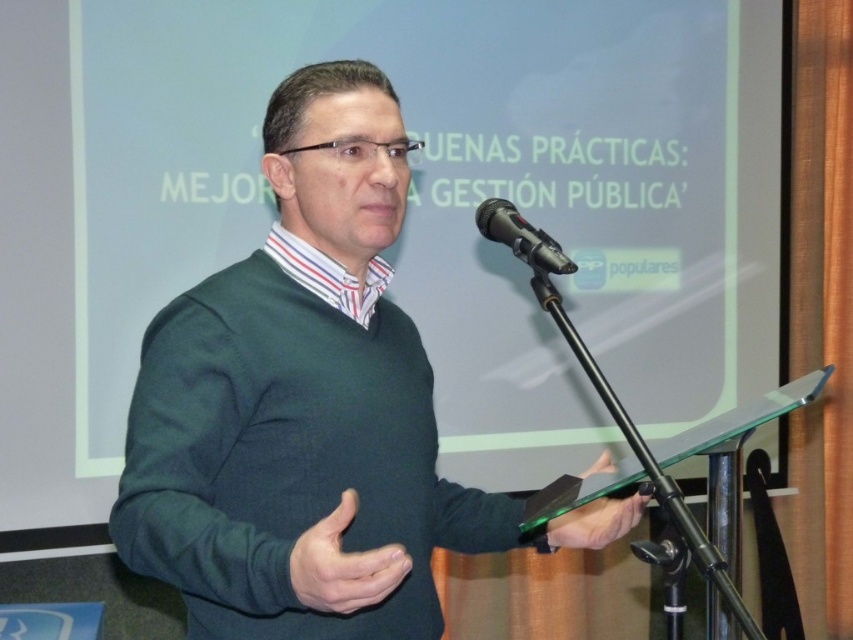
Question: Is green matte sweater at center closer to the viewer compared to black metallic microphone at center?

Choices:
 (A) no
 (B) yes

Answer: (B)

Question: Can you confirm if green matte sweater at center is smaller than black metallic microphone at center?

Choices:
 (A) yes
 (B) no

Answer: (B)

Question: Which object is farther from the camera taking this photo?

Choices:
 (A) green matte sweater at center
 (B) black metallic microphone at center

Answer: (B)

Question: Is green matte sweater at center above black metallic microphone at center?

Choices:
 (A) yes
 (B) no

Answer: (B)

Question: Among these points, which one is nearest to the camera?

Choices:
 (A) (489, 211)
 (B) (146, 472)

Answer: (B)